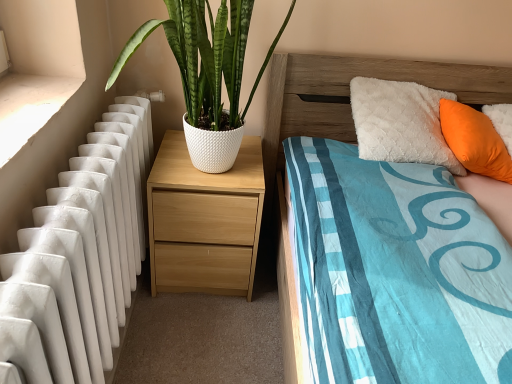
At what (x,y) coordinates should I click in order to perform the action: click on blank space situated above light wood/texture nightstand at center (from a real-world perspective). Please return your answer as a coordinate pair (x, y). Image resolution: width=512 pixels, height=384 pixels. Looking at the image, I should click on (192, 164).